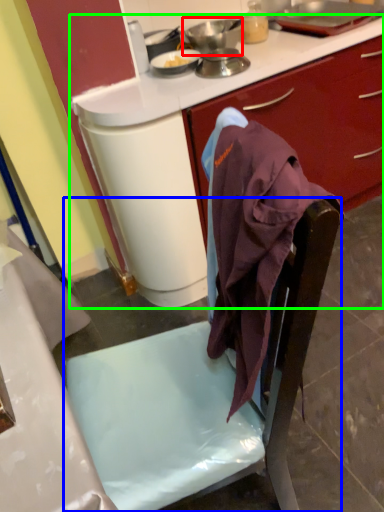
Question: Which object is the farthest from kitchen appliance (highlighted by a red box)? Choose among these: chair (highlighted by a blue box) or desk (highlighted by a green box).

Choices:
 (A) chair
 (B) desk

Answer: (A)